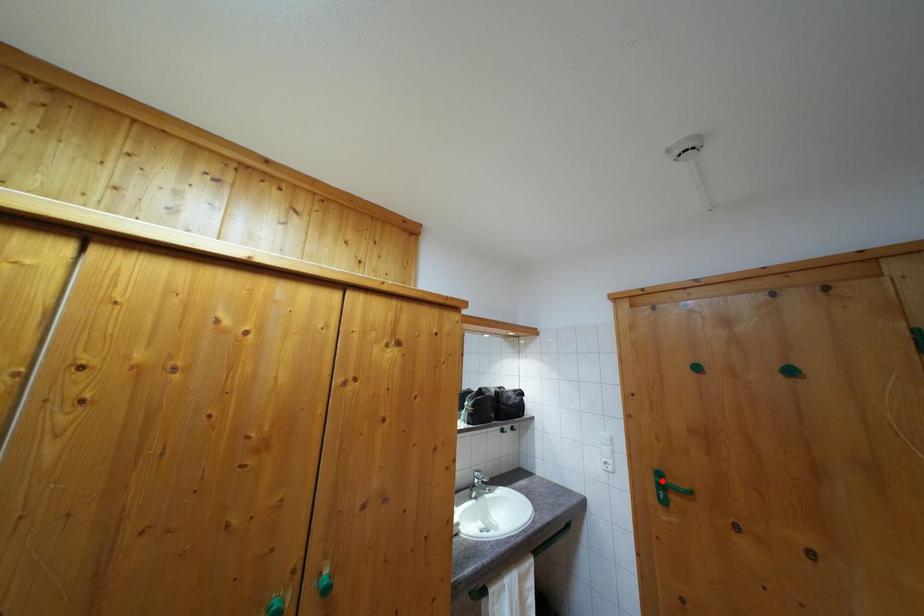
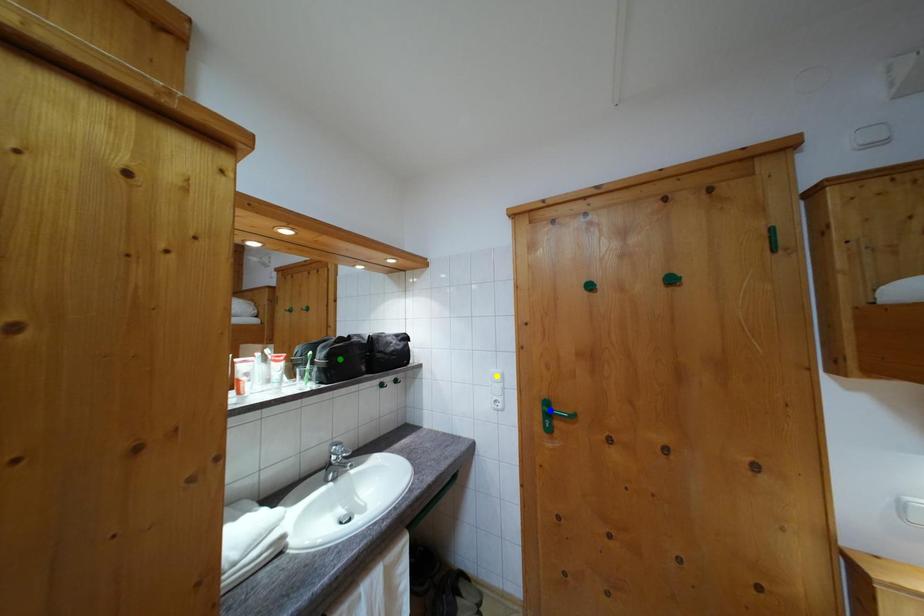
Question: I am providing you with two images of the same scene from different viewpoints. A red point is marked on the first image. You are given multiple points on the second image. Which point in image 2 is actually the same real-world point as the red point in image 1?

Choices:
 (A) blue point
 (B) yellow point
 (C) green point

Answer: (A)